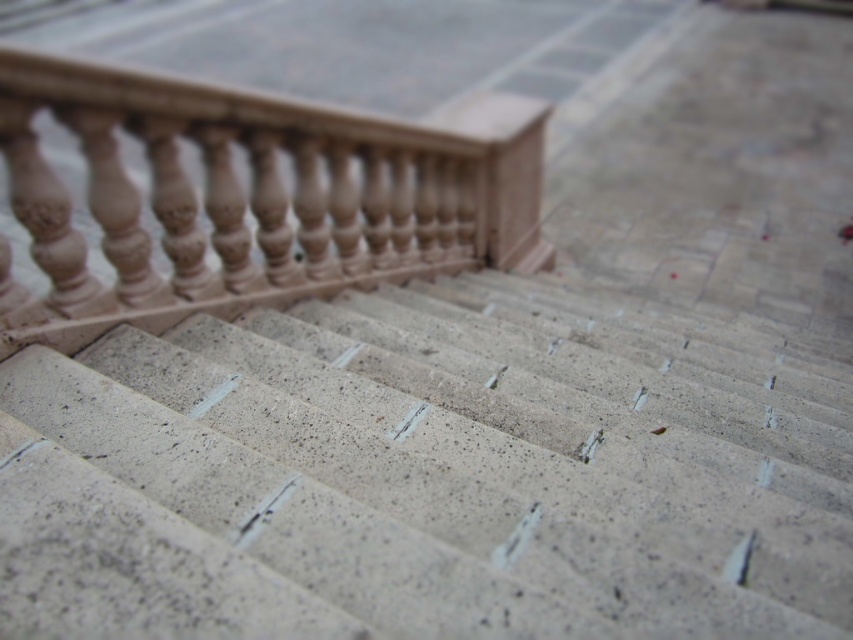
You are standing at the bottom of the granite stairs at center and want to reach the sandy beige stone balustrade at upper left. Which direction should you move towards?

You should move to the left because the granite stairs at center are to the right of the sandy beige stone balustrade at upper left, so moving left would take you towards it.

You are standing on the granite stairs at center and want to reach the sandy beige stone balustrade at upper left. Which direction should you move to get closer to the balustrade?

Since the granite stairs at center are closer to the viewer than the sandy beige stone balustrade at upper left, you should move forward in the direction towards the upper part of the stairs to approach the balustrade.

You are a delivery person carrying a large box that is 3 feet wide. You need to navigate through the space between the granite stairs at center and the sandy beige stone balustrade at upper left. Can your box fit through this space without touching either side?

The granite stairs at center and sandy beige stone balustrade at upper left are 31.85 inches apart. Since 3 feet is equal to 36 inches, the box is wider than the available space. Therefore, the box cannot fit through the space without touching either side.